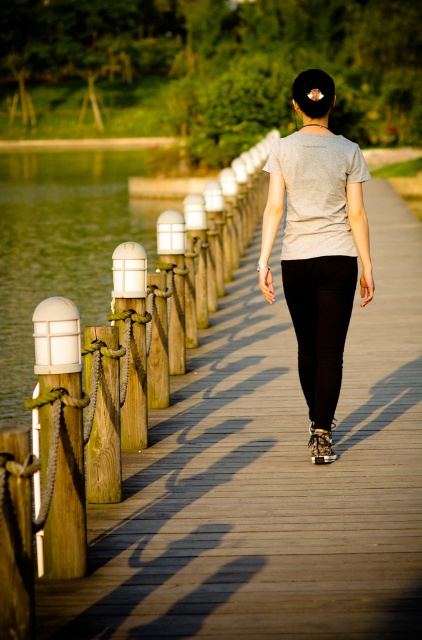
Is gray cotton shirt at center to the right of white painted wood post at left from the viewer's perspective?

Yes, gray cotton shirt at center is to the right of white painted wood post at left.

Identify the location of gray cotton shirt at center. This screenshot has height=640, width=422. (318, 244).

In order to click on gray cotton shirt at center in this screenshot , I will do `click(318, 244)`.

Can you confirm if white matte pole at left is positioned below white painted wood post at left?

Indeed, white matte pole at left is positioned under white painted wood post at left.

Image resolution: width=422 pixels, height=640 pixels. I want to click on white matte pole at left, so click(61, 436).

Which is in front, point (80, 346) or point (132, 429)?

Point (80, 346) is in front.

This screenshot has width=422, height=640. In order to click on white matte pole at left in this screenshot , I will do `click(61, 436)`.

Which is below, gray cotton shirt at center or white matte pole at left?

white matte pole at left is below.

Between point (300, 264) and point (57, 476), which one is positioned behind?

The point (300, 264) is more distant.

Which is in front, point (322, 259) or point (38, 528)?

Point (38, 528) is more forward.

Find the location of a particular element. The height and width of the screenshot is (640, 422). gray cotton shirt at center is located at coordinates (318, 244).